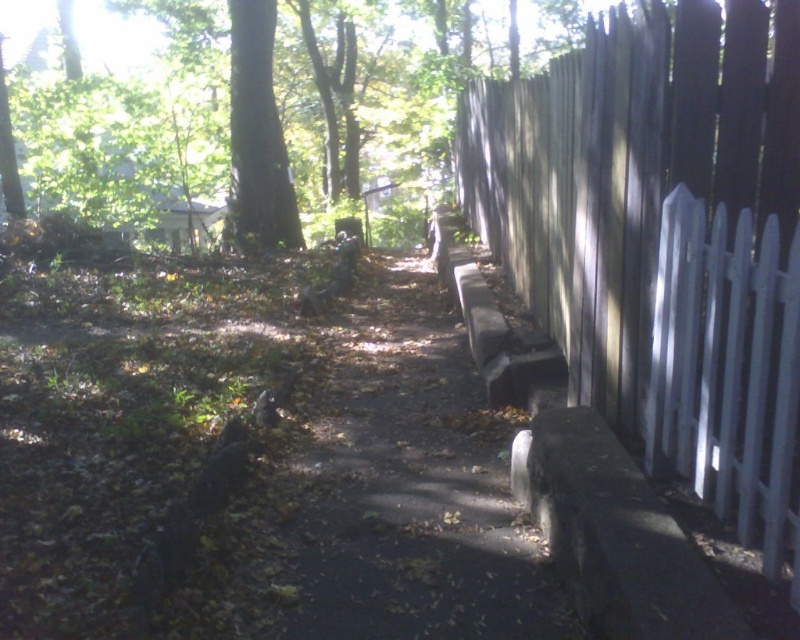
You are standing at the starting point of the pathway in the residential area. You see two points marked on the ground ahead of you. The first point is at coordinates point (758, 248) and the second is at point (293, 602). Which point is closer to you as you face the direction the pathway is heading?

Point (758, 248) is in front of point (293, 602), so the first point is closer to you as you face the pathway direction.

You are a gardener with a 1.2 meter wide lawnmower. You need to mow the area between the wooden picket fence at right and the brown dirt path at center. Can your lawnmower fit through the space between them?

The wooden picket fence at right and brown dirt path at center are 1.02 meters apart from each other. Since the lawnmower is 1.2 meters wide, it cannot fit through the space between them.

You are standing at the starting point of the pathway and see two points marked on the path. The first point is at coordinates point (780, 163) and the second is at point (230, 72). Which point is closer to you as you stand at the beginning of the path?

Point (780, 163) is closer to the viewer than point (230, 72), so the first point is closer to you.